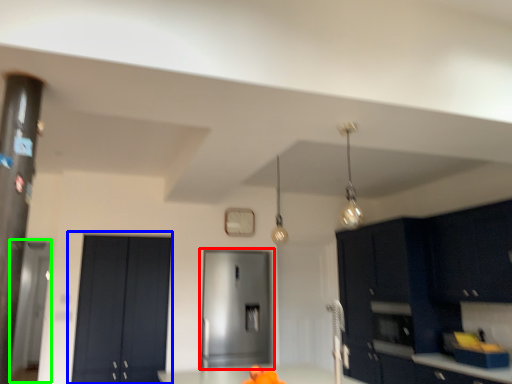
Question: Considering the real-world distances, which object is farthest from door (highlighted by a red box)? door (highlighted by a blue box) or glass door (highlighted by a green box)?

Choices:
 (A) door
 (B) glass door

Answer: (B)